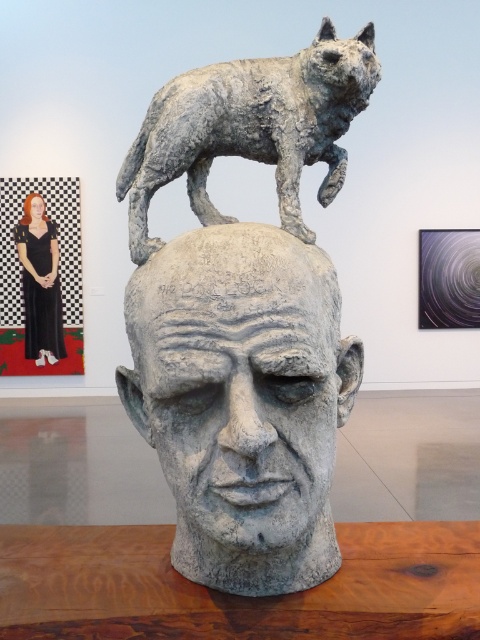
Question: Does black dress at upper left have a larger size compared to matte black portrait at upper left?

Choices:
 (A) no
 (B) yes

Answer: (B)

Question: Which of the following is the closest to the observer?

Choices:
 (A) (160, 164)
 (B) (176, 173)

Answer: (A)

Question: Which object appears closest to the camera in this image?

Choices:
 (A) gray textured dog at upper center
 (B) matte black portrait at upper left
 (C) gray stone head at center

Answer: (C)

Question: Where is gray textured dog at upper center located in relation to black dress at upper left in the image?

Choices:
 (A) right
 (B) left

Answer: (A)

Question: Can you confirm if gray textured dog at upper center is positioned below black dress at upper left?

Choices:
 (A) yes
 (B) no

Answer: (A)

Question: Which of the following is the closest to the observer?

Choices:
 (A) gray textured dog at upper center
 (B) gray stone head at center
 (C) black dress at upper left

Answer: (B)